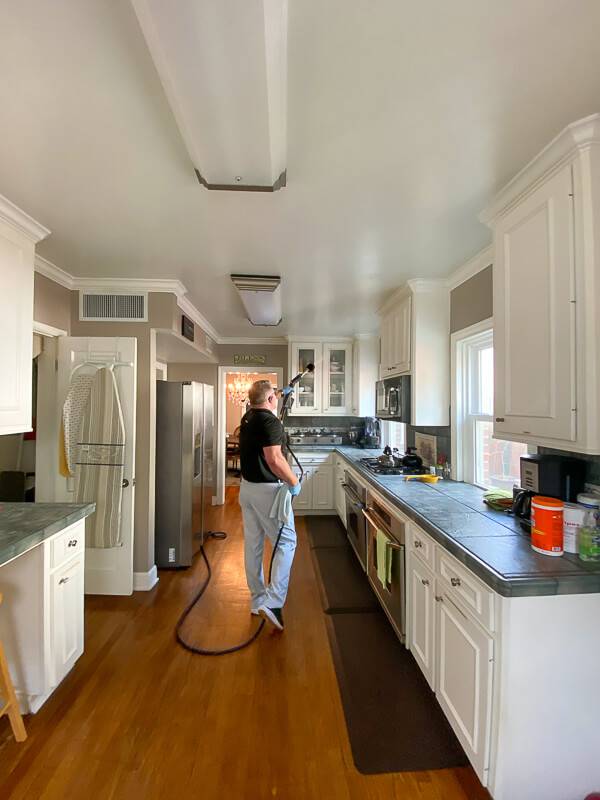
At what (x,y) coordinates should I click in order to perform the action: click on green tile countertop. Please return your answer as a coordinate pair (x, y). The image size is (600, 800). Looking at the image, I should click on (445, 501).